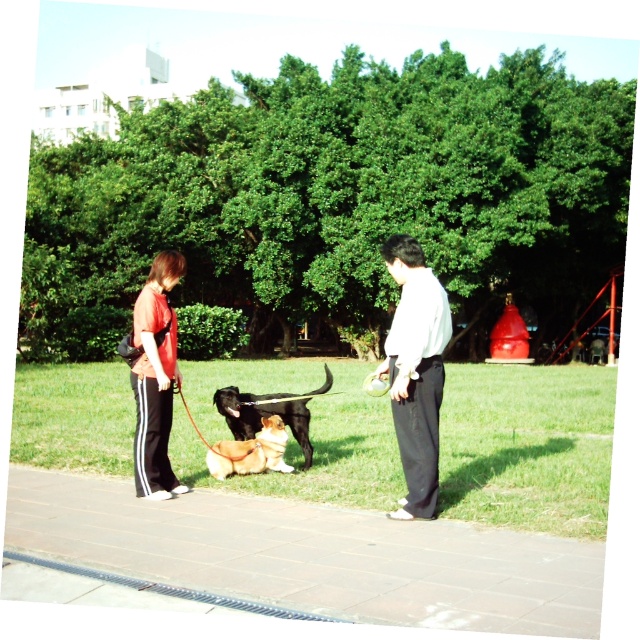
Question: Which object is closer to the camera taking this photo?

Choices:
 (A) brown plush dog at center
 (B) gray concrete pavement at lower center
 (C) shiny black dog at center

Answer: (B)

Question: Does matte red shirt at center lie behind brown plush dog at center?

Choices:
 (A) yes
 (B) no

Answer: (B)

Question: From the image, what is the correct spatial relationship of matte red shirt at center in relation to shiny black dog at center?

Choices:
 (A) left
 (B) right

Answer: (A)

Question: Which object is closer to the camera taking this photo?

Choices:
 (A) brown plush dog at center
 (B) matte red shirt at center
 (C) light blue shirt at center
 (D) gray concrete pavement at lower center

Answer: (D)

Question: Is gray concrete pavement at lower center to the right of brown plush dog at center from the viewer's perspective?

Choices:
 (A) no
 (B) yes

Answer: (B)

Question: Which point is closer to the camera?

Choices:
 (A) gray concrete pavement at lower center
 (B) brown plush dog at center
 (C) shiny black dog at center
 (D) matte red shirt at center

Answer: (A)